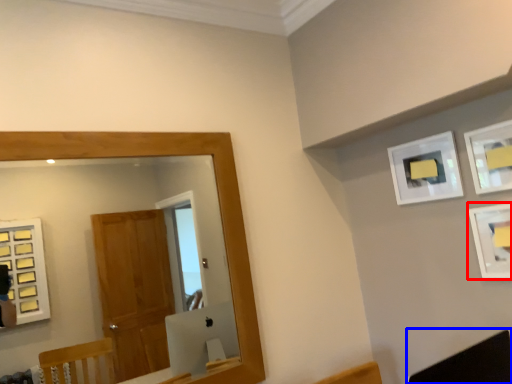
Question: Which of the following is the farthest to the observer, picture frame (highlighted by a red box) or swivel chair (highlighted by a blue box)?

Choices:
 (A) picture frame
 (B) swivel chair

Answer: (A)